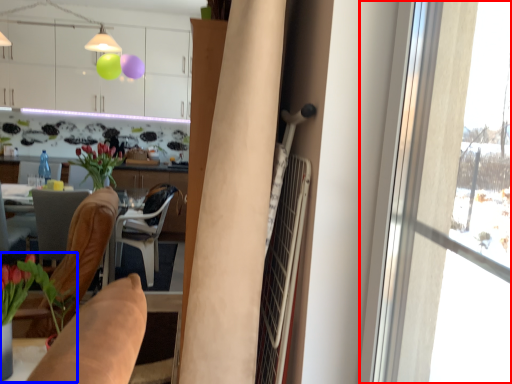
Question: Among these objects, which one is farthest to the camera, window (highlighted by a red box) or houseplant (highlighted by a blue box)?

Choices:
 (A) window
 (B) houseplant

Answer: (B)